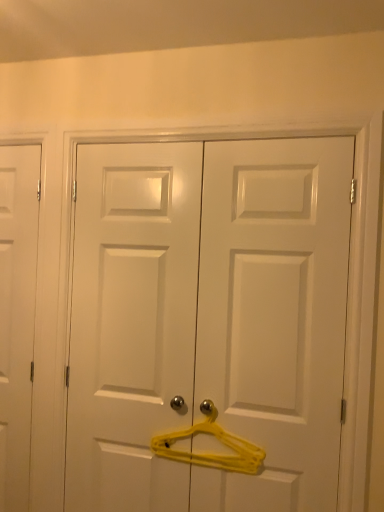
Question: Could you tell me if yellow plastic hanger at center is facing white matte door at left, which is the 2th door from front to back?

Choices:
 (A) no
 (B) yes

Answer: (A)

Question: Can you confirm if yellow plastic hanger at center is positioned to the right of white matte door at left, the first door when ordered from back to front?

Choices:
 (A) yes
 (B) no

Answer: (A)

Question: From the image's perspective, does yellow plastic hanger at center appear higher than white matte door at left, the first door viewed from the left?

Choices:
 (A) yes
 (B) no

Answer: (B)

Question: Is yellow plastic hanger at center surrounding white matte door at left, the first door when ordered from back to front?

Choices:
 (A) no
 (B) yes

Answer: (A)

Question: Is yellow plastic hanger at center closer to camera compared to white matte door at left, which is the 2th door from front to back?

Choices:
 (A) no
 (B) yes

Answer: (B)

Question: Is yellow plastic hanger at center positioned behind white matte door at left, the first door when ordered from back to front?

Choices:
 (A) no
 (B) yes

Answer: (A)

Question: Can you confirm if white glossy door at center, placed as the 1th door when sorted from right to left, is taller than yellow plastic hanger at center?

Choices:
 (A) yes
 (B) no

Answer: (A)

Question: Could you tell me if white glossy door at center, placed as the 1th door when sorted from right to left, is facing yellow plastic hanger at center?

Choices:
 (A) no
 (B) yes

Answer: (B)

Question: Is white glossy door at center, placed as the 1th door when sorted from right to left, in contact with yellow plastic hanger at center?

Choices:
 (A) no
 (B) yes

Answer: (A)

Question: Considering the relative sizes of white glossy door at center, placed as the 1th door when sorted from right to left, and yellow plastic hanger at center in the image provided, is white glossy door at center, placed as the 1th door when sorted from right to left, wider than yellow plastic hanger at center?

Choices:
 (A) no
 (B) yes

Answer: (B)

Question: Does white glossy door at center, placed as the 1th door when sorted from right to left, come behind yellow plastic hanger at center?

Choices:
 (A) no
 (B) yes

Answer: (A)

Question: Is white glossy door at center, marked as the 2th door in a back-to-front arrangement, bigger than yellow plastic hanger at center?

Choices:
 (A) yes
 (B) no

Answer: (A)

Question: Does white matte door at left, which is the 2th door from front to back, have a larger size compared to white glossy door at center, placed as the 1th door when sorted from right to left?

Choices:
 (A) no
 (B) yes

Answer: (A)